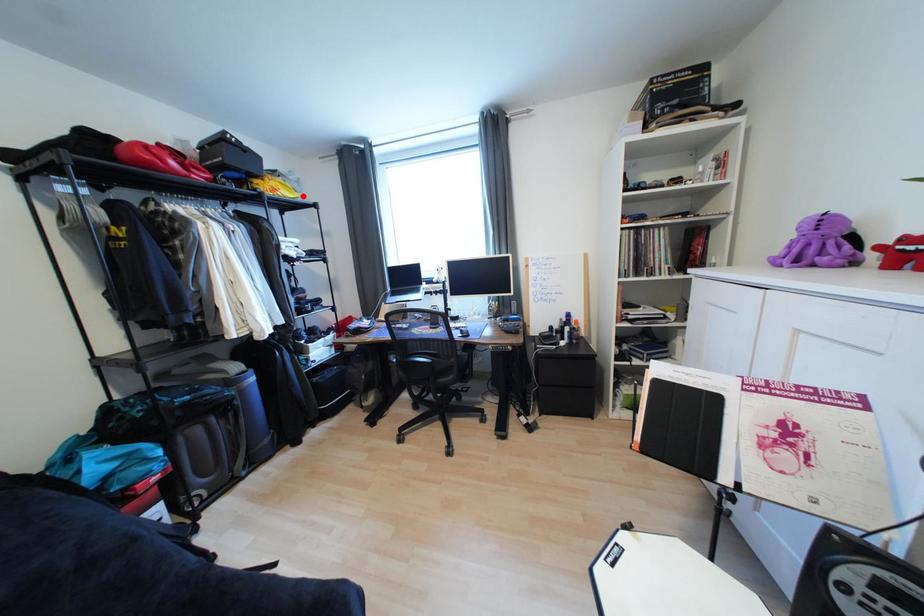
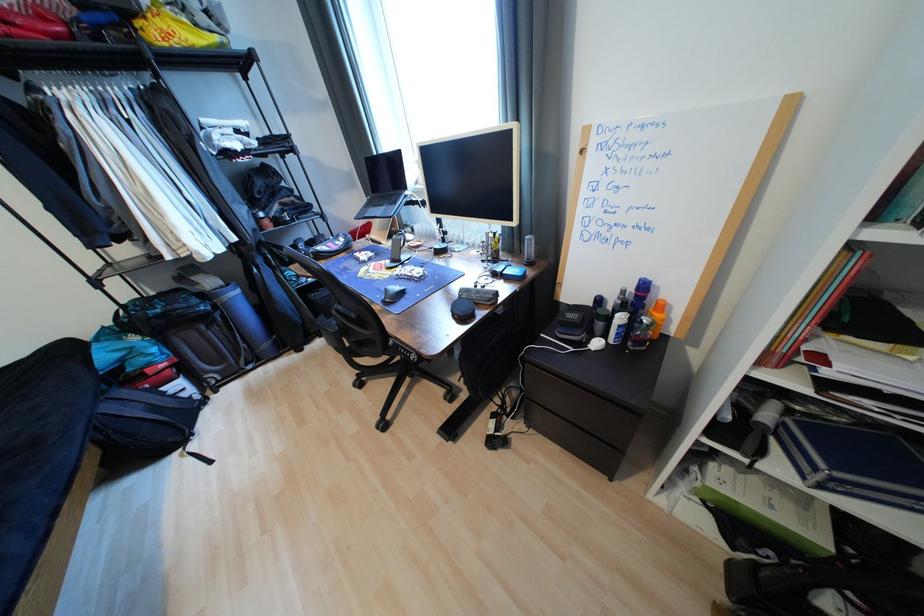
In the second image, find the point that corresponds to the highlighted location in the first image.

(223, 39)